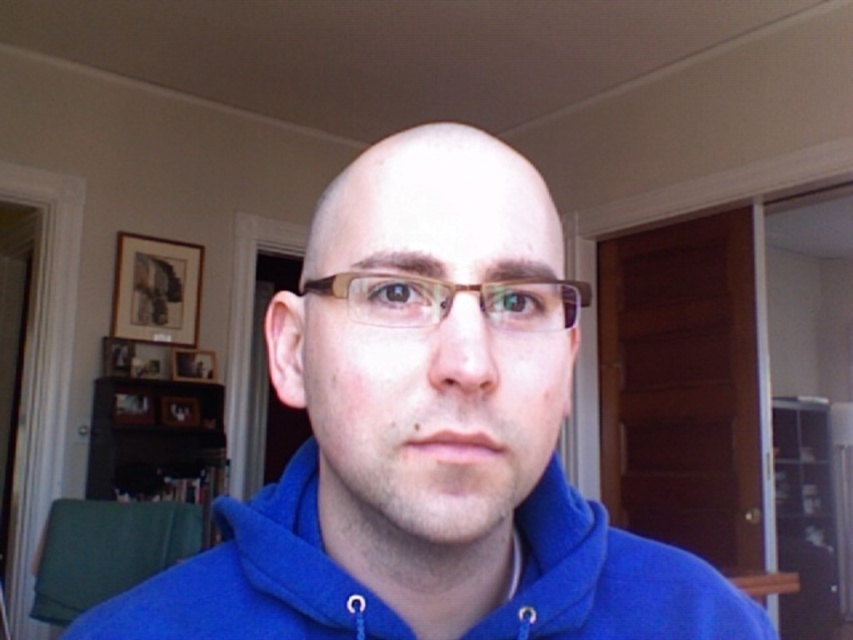
You are standing in the room and want to move from the point at coordinate (412, 429) to the point at coordinate (519, 632). Which direction should you move to get closer to your destination?

Since point (412, 429) is in front of point (519, 632), you should move backward to reach the destination point (519, 632).